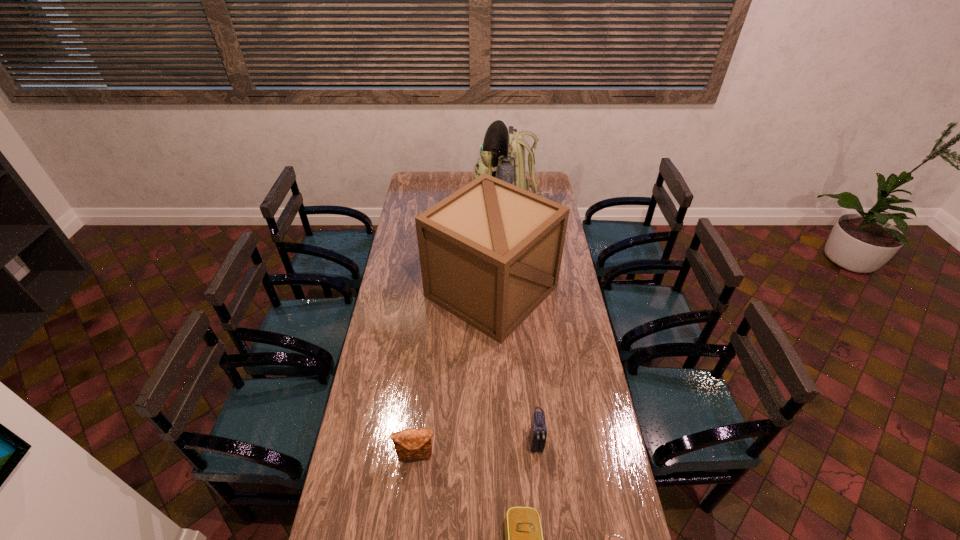
Where is `object present at the far edge`? This screenshot has height=540, width=960. object present at the far edge is located at coordinates (502, 153).

Image resolution: width=960 pixels, height=540 pixels. What are the coordinates of `object located at the left edge` in the screenshot? It's located at (410, 444).

Identify the location of backpack present at the right edge. (502, 153).

Where is `box that is at the right edge`? The width and height of the screenshot is (960, 540). box that is at the right edge is located at coordinates (490, 253).

Image resolution: width=960 pixels, height=540 pixels. I want to click on object that is at the far right corner, so click(502, 153).

I want to click on free space at the far edge of the desktop, so point(435,189).

I want to click on vacant space at the left edge of the desktop, so click(376, 539).

I want to click on vacant space at the right edge of the desktop, so click(568, 418).

Where is `free space between the second tallest object and the leftmost clutch bag`? The height and width of the screenshot is (540, 960). free space between the second tallest object and the leftmost clutch bag is located at coordinates (454, 374).

Find the location of a particular element. Image resolution: width=960 pixels, height=540 pixels. free space that is in between the leftmost clutch bag and the fifth shortest object is located at coordinates (454, 374).